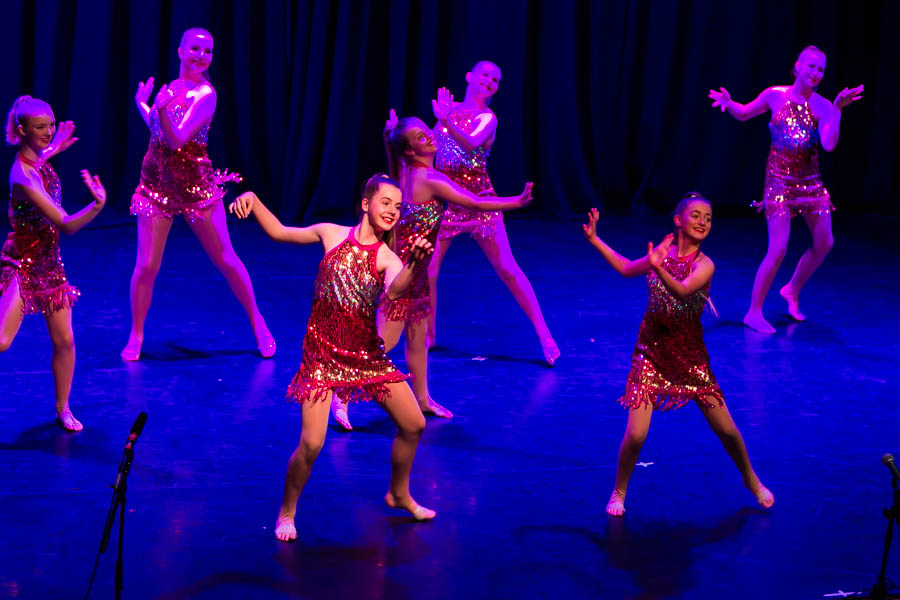
At what (x,y) coordinates should I click in order to perform the action: click on curtain. Please return your answer as a coordinate pair (x, y). Looking at the image, I should click on (616, 135).